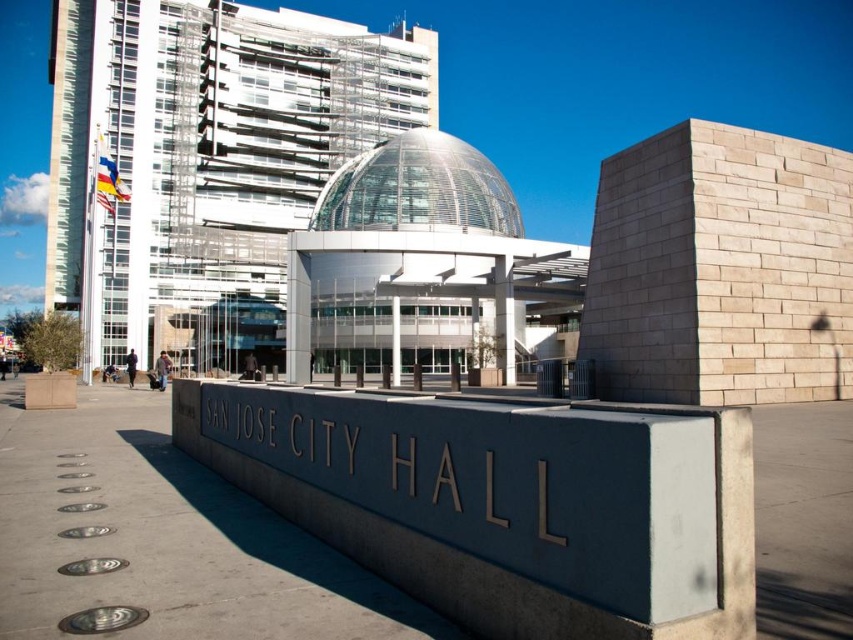
Does gray concrete sign at center come behind transparent glass dome at center?

That is False.

Does point (283, 419) come in front of point (398, 275)?

Yes, it is.

This screenshot has width=853, height=640. I want to click on gray concrete sign at center, so click(x=505, y=500).